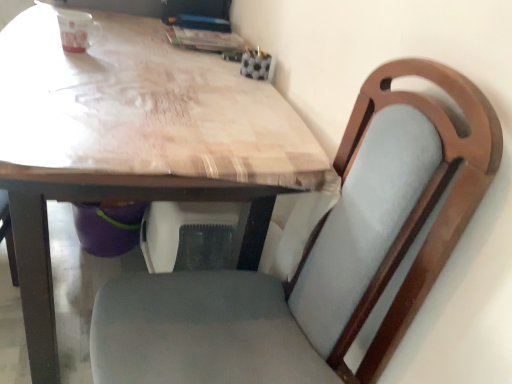
This screenshot has width=512, height=384. Describe the element at coordinates (130, 139) in the screenshot. I see `wooden table at center` at that location.

Measure the distance between wooden table at center and camera.

The depth of wooden table at center is 25.76 inches.

Identify the location of wooden table at center. (130, 139).

I want to click on wooden table at center, so click(x=130, y=139).